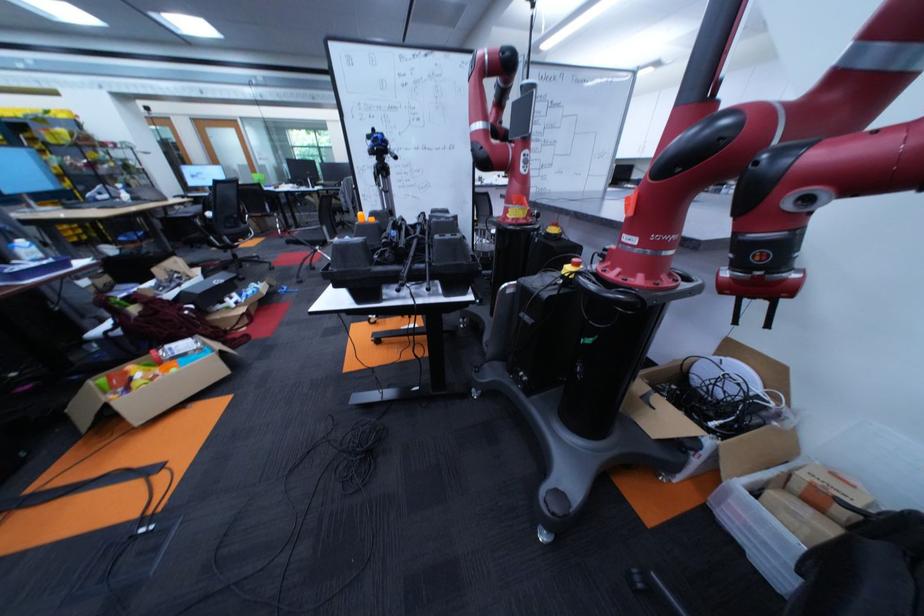
You are a GUI agent. You are given a task and a screenshot of the screen. Output one action in this format:
    pyautogui.click(x=<x>, y=<y>)
    Task: Click on the red emergency button
    The width and height of the screenshot is (924, 616).
    Given the screenshot: What is the action you would take?
    pyautogui.click(x=572, y=267)